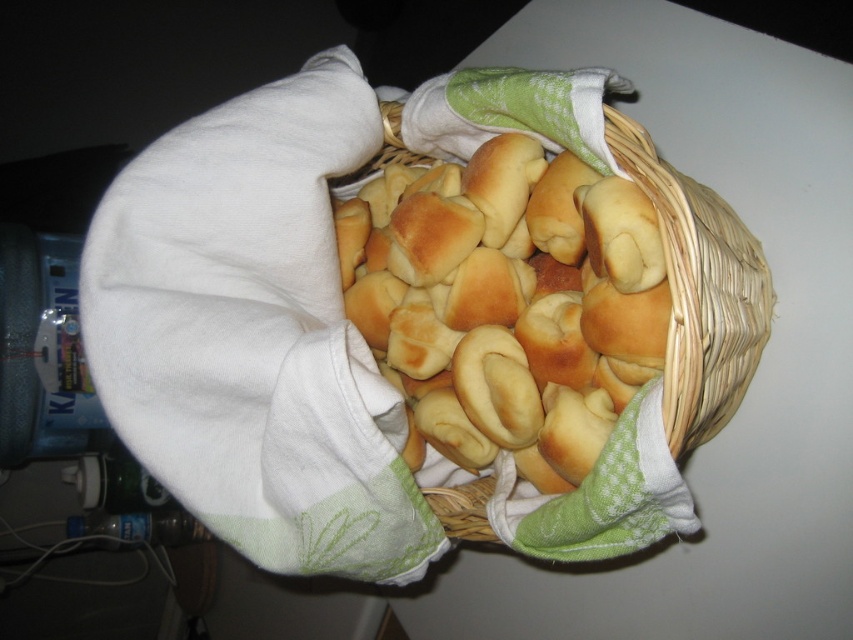
Does point (276, 397) come behind point (737, 330)?

No, it is not.

Is white cotton cloth at upper left to the left of woven straw basket at center from the viewer's perspective?

Yes, white cotton cloth at upper left is to the left of woven straw basket at center.

Is point (256, 401) positioned behind point (704, 228)?

Yes, it is.

The height and width of the screenshot is (640, 853). Identify the location of white cotton cloth at upper left. (254, 333).